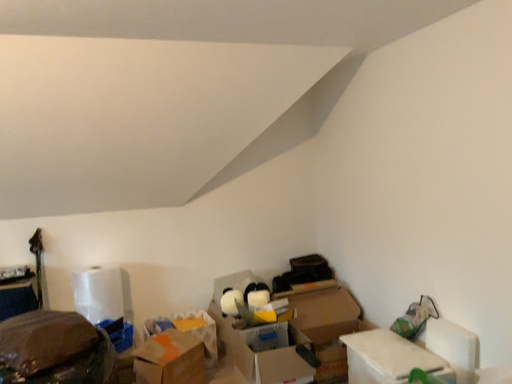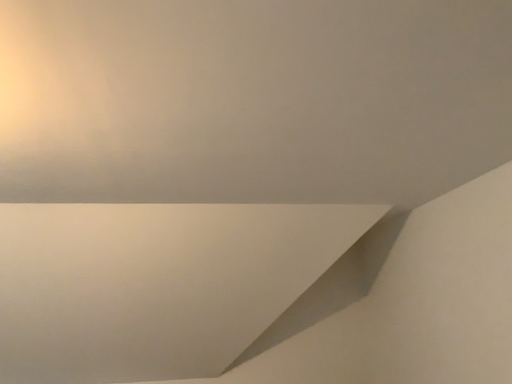
Question: How did the camera likely rotate when shooting the video?

Choices:
 (A) rotated downward
 (B) rotated upward

Answer: (B)